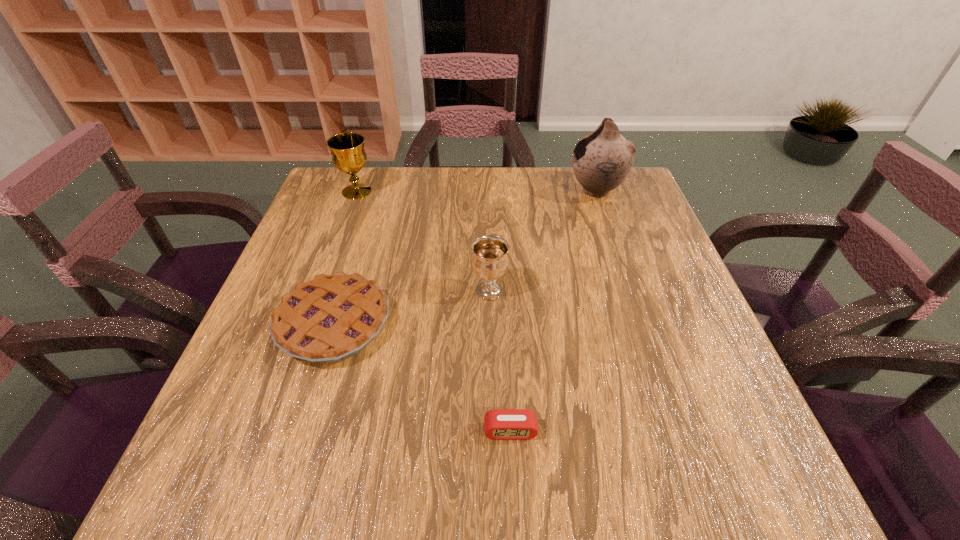
What are the coordinates of `the rightmost object` in the screenshot? It's located at (601, 161).

This screenshot has height=540, width=960. I want to click on pottery, so click(601, 161).

This screenshot has width=960, height=540. I want to click on the left chalice, so point(347,150).

Find the location of a particular element. The image size is (960, 540). the second tallest object is located at coordinates (347, 150).

Identify the location of the third shortest object. (490, 260).

You are a GUI agent. You are given a task and a screenshot of the screen. Output one action in this format:
    pyautogui.click(x=<x>, y=<y>)
    Task: Click on the nearer chalice
    The image size is (960, 540).
    Given the screenshot: What is the action you would take?
    pyautogui.click(x=490, y=260)

The image size is (960, 540). I want to click on the fourth tallest object, so click(x=331, y=318).

In order to click on the shortest object in this screenshot , I will do pos(499,424).

Locate an element on the screen. This screenshot has width=960, height=540. alarm clock is located at coordinates (499, 424).

The image size is (960, 540). What are the coordinates of `vacant space situated from the spout of the tallest object` in the screenshot? It's located at pyautogui.click(x=458, y=190).